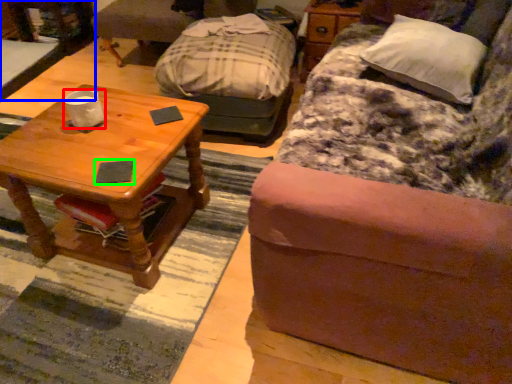
Question: Which is nearer to the coffee cup (highlighted by a red box)? desk (highlighted by a blue box) or pad (highlighted by a green box).

Choices:
 (A) desk
 (B) pad

Answer: (B)